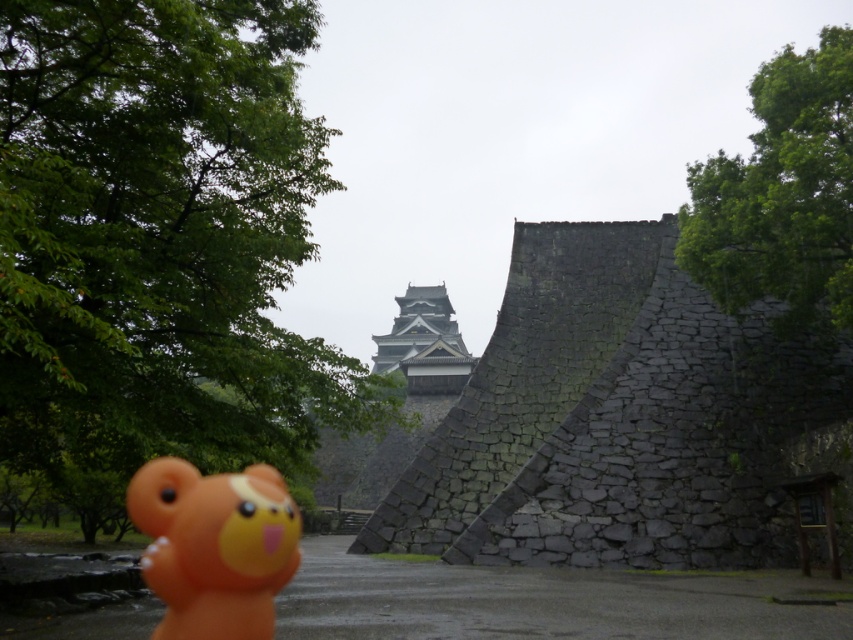
Question: Does dark gray stone wall at center lie in front of orange rubber bear at lower left?

Choices:
 (A) yes
 (B) no

Answer: (B)

Question: Does dark gray stone wall at center come behind orange rubber bear at lower left?

Choices:
 (A) no
 (B) yes

Answer: (B)

Question: Does dark gray stone wall at center have a smaller size compared to orange rubber bear at lower left?

Choices:
 (A) yes
 (B) no

Answer: (B)